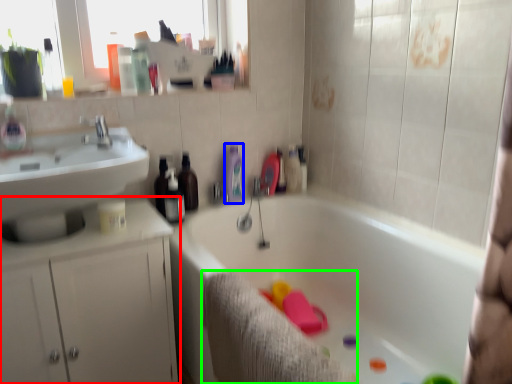
Question: Which object is the closest to the bathroom cabinet (highlighted by a red box)? Choose among these: toiletry (highlighted by a blue box) or bath towel (highlighted by a green box).

Choices:
 (A) toiletry
 (B) bath towel

Answer: (B)